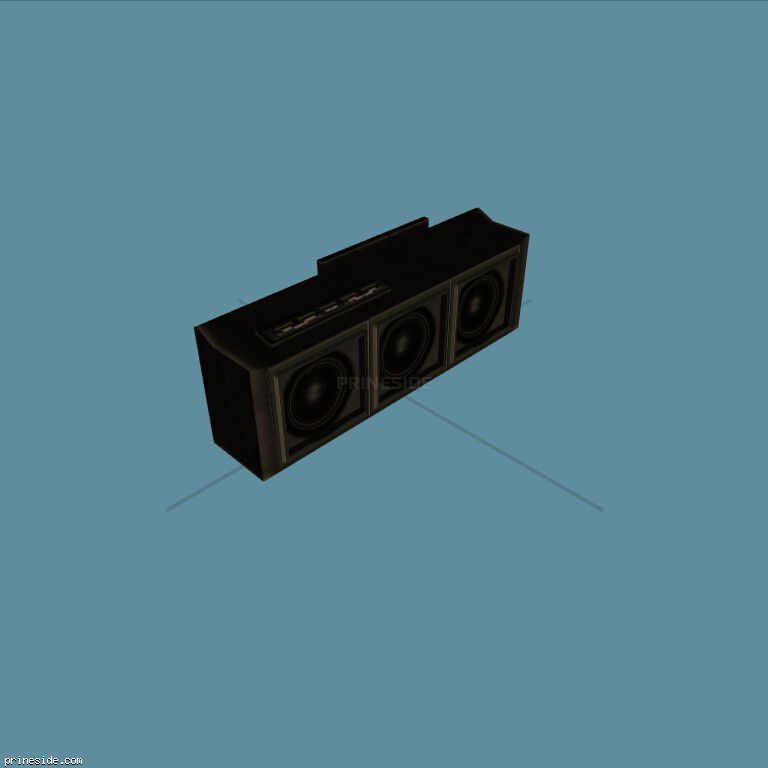
You are a GUI agent. You are given a task and a screenshot of the screen. Output one action in this format:
    pyautogui.click(x=<x>, y=<y>)
    Task: Click on the speakers
    The width and height of the screenshot is (768, 768).
    Given the screenshot: What is the action you would take?
    pyautogui.click(x=406, y=336)